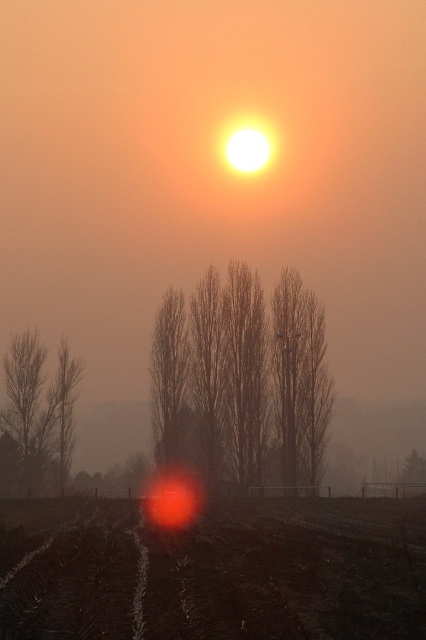
Question: Is silhouette bare tree at left thinner than brown textured tree at center?

Choices:
 (A) yes
 (B) no

Answer: (B)

Question: Observing the image, what is the correct spatial positioning of silhouetted bare trees at center in reference to brown textured tree at center?

Choices:
 (A) above
 (B) below

Answer: (B)

Question: Which point is closer to the camera taking this photo?

Choices:
 (A) (43, 408)
 (B) (227, 282)

Answer: (B)

Question: Which object is positioned farthest from the brown textured tree at center?

Choices:
 (A) silhouette bare tree at left
 (B) silhouetted bare trees at center

Answer: (A)

Question: Is silhouetted bare trees at center thinner than silhouette bare tree at left?

Choices:
 (A) yes
 (B) no

Answer: (B)

Question: Which is nearer to the silhouetted bare trees at center?

Choices:
 (A) brown textured tree at center
 (B) silhouette bare tree at left

Answer: (A)